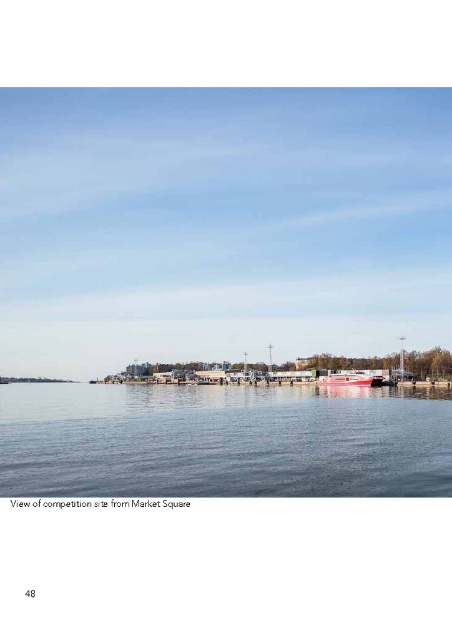
Is transparent blue water at center below red glossy boat at center?

Yes.

Which is behind, point (353, 449) or point (354, 372)?

Positioned behind is point (354, 372).

Describe the element at coordinates (221, 442) in the screenshot. I see `transparent blue water at center` at that location.

Identify the location of transparent blue water at center. (221, 442).